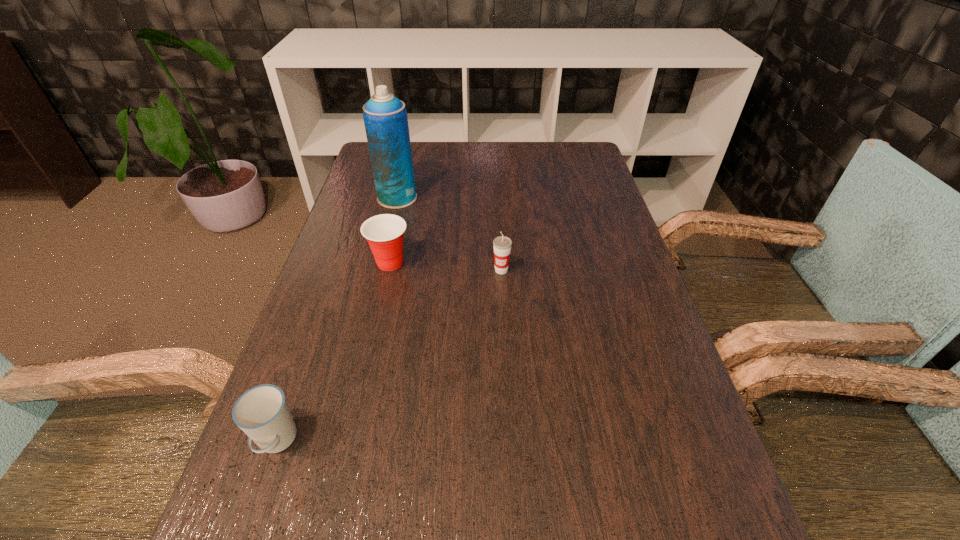
Locate an element on the screen. The height and width of the screenshot is (540, 960). aerosol can at the left edge is located at coordinates (385, 118).

Find the location of a particular element. The image size is (960, 540). vacant region at the far edge of the desktop is located at coordinates (443, 143).

Identify the location of free space at the left edge. (265, 535).

This screenshot has height=540, width=960. In the image, there is a desktop. Identify the location of vacant space at the right edge. (574, 284).

Locate an element on the screen. The height and width of the screenshot is (540, 960). free region at the far left corner of the desktop is located at coordinates (366, 155).

In the image, there is a desktop. At what (x,y) coordinates should I click in order to perform the action: click on free space at the far right corner. Please return your answer as a coordinate pair (x, y). The height and width of the screenshot is (540, 960). Looking at the image, I should click on (562, 145).

Locate an element on the screen. The width and height of the screenshot is (960, 540). empty space that is in between the tallest object and the rightmost cup is located at coordinates (449, 234).

Locate an element on the screen. Image resolution: width=960 pixels, height=540 pixels. vacant area that lies between the leftmost object and the aerosol can is located at coordinates (337, 320).

Locate an element on the screen. The height and width of the screenshot is (540, 960). free space between the second cup from left to right and the leftmost object is located at coordinates (333, 352).

The image size is (960, 540). I want to click on vacant space that is in between the second cup from right to left and the rightmost cup, so click(x=445, y=266).